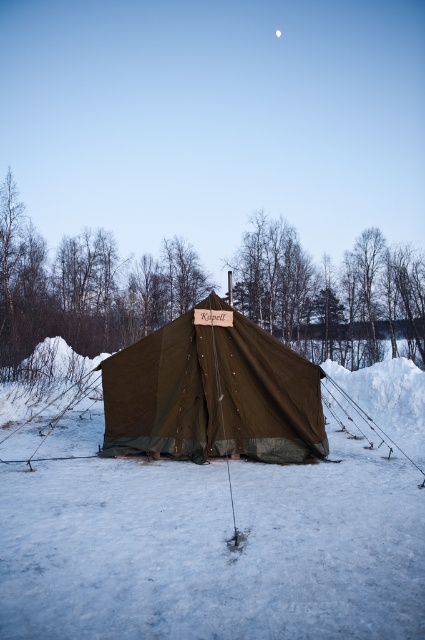
You are standing in the snowy landscape and want to take a photo of the olive green canvas tent at center and the white matte moon at upper center. Which object should you point your camera towards first if you want to capture both in a single frame without moving your camera?

You should point your camera towards the olive green canvas tent at center first because it is closer to you than the white matte moon at upper center, allowing both to be captured in the same frame.

You are a winter traveler carrying a 1.5 meter wide sled. You want to set up your sled between the olive green canvas tent at center and the snow wall around its base. Is there enough space for your sled?

The distance between the olive green canvas tent at center and the snow wall around its base is 8.66 meters, so yes, the sled can be placed there since it is wider than the sled.

You are an astronaut stranded on the moon and see the image. You need to determine if you can use the white fluffy snow at center and the white matte moon at upper center to build a shelter. Which object is bigger and can be used more effectively?

The white fluffy snow at center is larger in size than the white matte moon at upper center, so it can be used more effectively to build a shelter.